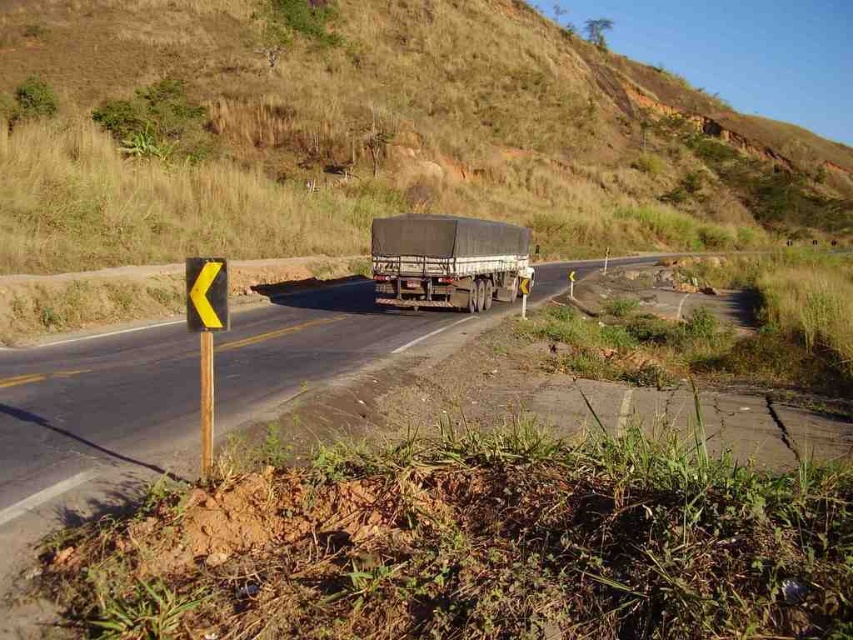
Does dark gray matte trailer truck at center have a lesser width compared to yellow plastic traffic sign at left?

In fact, dark gray matte trailer truck at center might be wider than yellow plastic traffic sign at left.

Who is positioned more to the right, dark gray matte trailer truck at center or yellow plastic traffic sign at left?

From the viewer's perspective, dark gray matte trailer truck at center appears more on the right side.

Between point (415, 232) and point (192, 273), which one is positioned in front?

Point (192, 273) is more forward.

Where is `dark gray matte trailer truck at center`? The height and width of the screenshot is (640, 853). dark gray matte trailer truck at center is located at coordinates (447, 260).

Is brown grassy hillside at upper center smaller than yellow plastic traffic sign at left?

Actually, brown grassy hillside at upper center might be larger than yellow plastic traffic sign at left.

Is brown grassy hillside at upper center positioned at the back of yellow plastic traffic sign at left?

Yes, it is.

Between point (454, 104) and point (192, 257), which one is positioned behind?

Positioned behind is point (454, 104).

I want to click on brown grassy hillside at upper center, so click(369, 132).

Is brown grassy hillside at upper center positioned behind dark gray matte trailer truck at center?

No, brown grassy hillside at upper center is closer to the viewer.

Measure the distance from brown grassy hillside at upper center to dark gray matte trailer truck at center.

A: brown grassy hillside at upper center and dark gray matte trailer truck at center are 49.48 meters apart from each other.

Between point (276, 4) and point (462, 221), which one is positioned in front?

Point (462, 221) is more forward.

Where is `brown grassy hillside at upper center`? The height and width of the screenshot is (640, 853). brown grassy hillside at upper center is located at coordinates (369, 132).